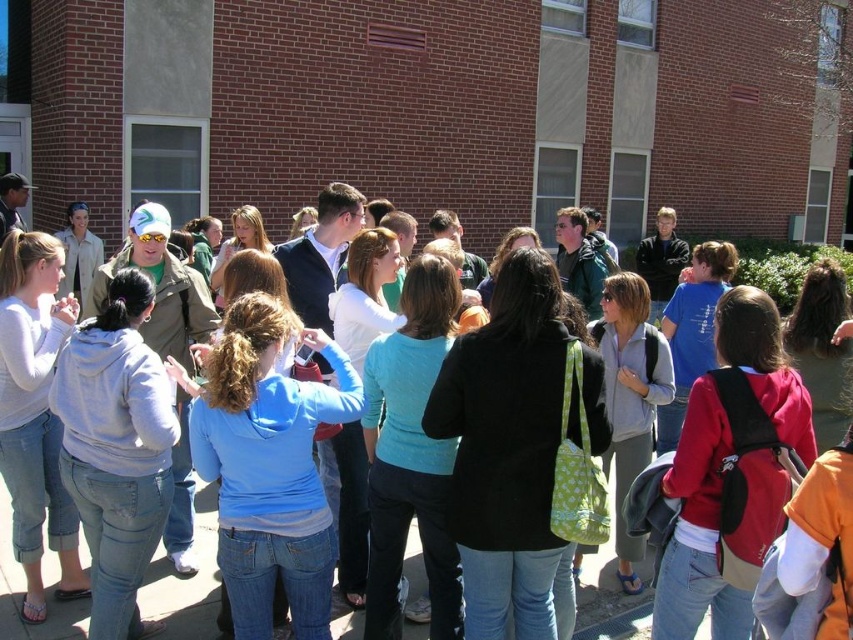
Question: Among these objects, which one is nearest to the camera?

Choices:
 (A) matte blue hoodie at center
 (B) blue fleece jacket at center

Answer: (B)

Question: Which point appears farthest from the camera in this image?

Choices:
 (A) (241, 374)
 (B) (630, 609)

Answer: (B)

Question: Can you confirm if blue fleece jacket at center is thinner than matte blue hoodie at center?

Choices:
 (A) yes
 (B) no

Answer: (B)

Question: Can you confirm if blue fleece jacket at center is smaller than matte blue hoodie at center?

Choices:
 (A) yes
 (B) no

Answer: (B)

Question: Which of the following is the closest to the observer?

Choices:
 (A) (7, 573)
 (B) (256, 557)

Answer: (B)

Question: Can you confirm if blue fleece jacket at center is positioned above matte blue hoodie at center?

Choices:
 (A) no
 (B) yes

Answer: (B)